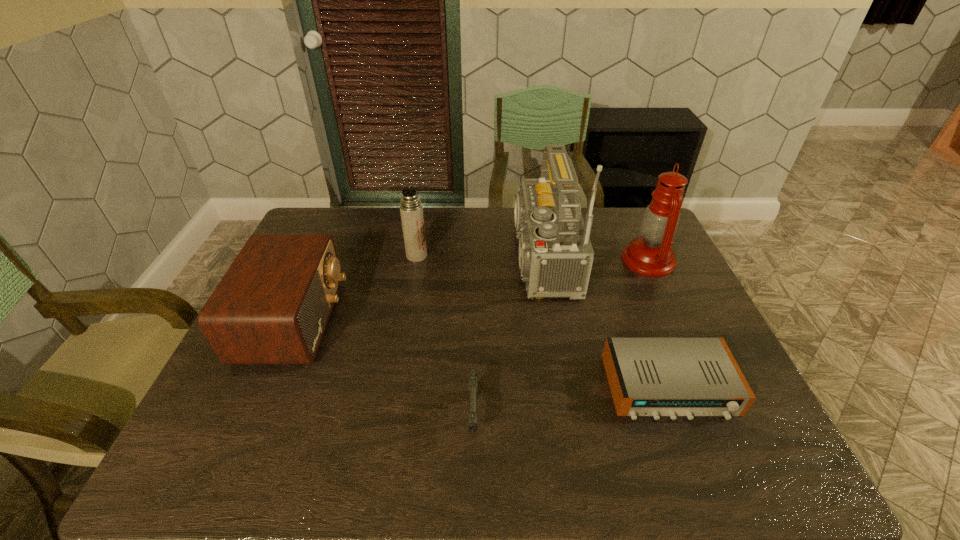
Locate an element on the screen. This screenshot has width=960, height=540. the shortest radio receiver is located at coordinates (656, 377).

Identify the location of free space located 0.270m on the front-facing side of the fourth object from left to right. Image resolution: width=960 pixels, height=540 pixels. (411, 258).

Where is `vacant space positioned on the front-facing side of the fourth object from left to right`? The width and height of the screenshot is (960, 540). vacant space positioned on the front-facing side of the fourth object from left to right is located at coordinates (386, 258).

Locate an element on the screen. The width and height of the screenshot is (960, 540). free space located 0.250m on the front-facing side of the fourth object from left to right is located at coordinates (418, 258).

Find the location of a particular element. free space located 0.320m on the left of the oil lamp is located at coordinates point(521,260).

At what (x,y) coordinates should I click in order to perform the action: click on vacant region located 0.350m on the left of the fifth object from right to left. Please return your answer as a coordinate pair (x, y). The height and width of the screenshot is (540, 960). Looking at the image, I should click on (298, 256).

Find the location of a particular element. Image resolution: width=960 pixels, height=540 pixels. free region located on the front panel of the leftmost radio receiver is located at coordinates (454, 321).

Find the location of `free region located 0.060m in the direction the fifth tallest object is aimed`. free region located 0.060m in the direction the fifth tallest object is aimed is located at coordinates (472, 475).

Locate an element on the screen. vacant region located on the control panel of the shortest object is located at coordinates (696, 457).

Locate an element on the screen. This screenshot has height=540, width=960. radio receiver located in the far edge section of the desktop is located at coordinates (555, 252).